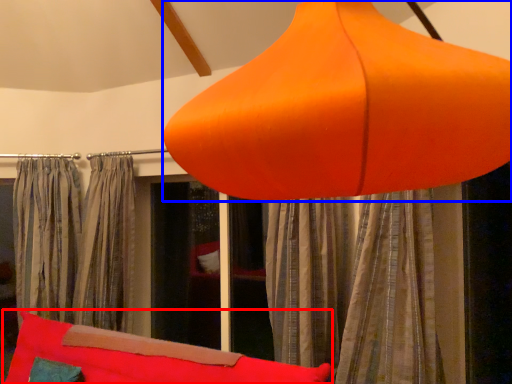
Question: Which object is further to the camera taking this photo, bean bag chair (highlighted by a red box) or lamp (highlighted by a blue box)?

Choices:
 (A) bean bag chair
 (B) lamp

Answer: (A)